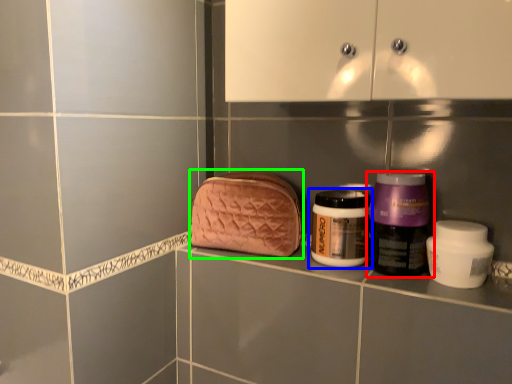
Question: Which object is the closest to the bottle (highlighted by a red box)? Choose among these: bottle (highlighted by a blue box) or pouch (highlighted by a green box).

Choices:
 (A) bottle
 (B) pouch

Answer: (A)